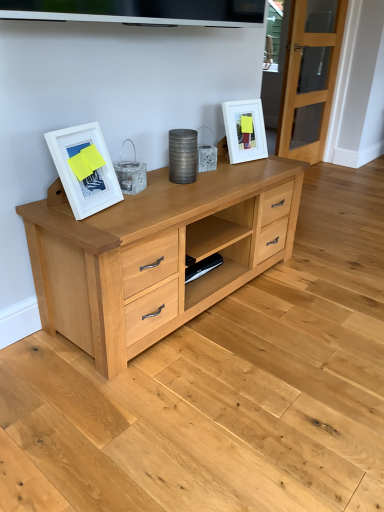
Locate an element on the screen. white matte picture frame at left, the first picture frame positioned from the left is located at coordinates (87, 167).

Measure the distance between white matte picture frame at upper right, which is the 2th picture frame in bottom-to-top order, and camera.

The depth of white matte picture frame at upper right, which is the 2th picture frame in bottom-to-top order, is 6.54 feet.

Identify the location of clear glass door at right. The image size is (384, 512). (309, 80).

The width and height of the screenshot is (384, 512). I want to click on white matte picture frame at left, arranged as the 2th picture frame when viewed from the back, so click(x=87, y=167).

Can you confirm if white matte picture frame at left, which appears as the 2th picture frame when viewed from the top, is smaller than clear glass door at right?

Yes, white matte picture frame at left, which appears as the 2th picture frame when viewed from the top, is smaller than clear glass door at right.

Would you say white matte picture frame at left, the 1th picture frame positioned from the bottom, is inside or outside clear glass door at right?

white matte picture frame at left, the 1th picture frame positioned from the bottom, cannot be found inside clear glass door at right.

Which object is more forward, white matte picture frame at left, the 1th picture frame positioned from the bottom, or clear glass door at right?

white matte picture frame at left, the 1th picture frame positioned from the bottom, is more forward.

Based on the photo, measure the distance from white matte picture frame at left, the 1th picture frame positioned from the bottom, to clear glass door at right.

white matte picture frame at left, the 1th picture frame positioned from the bottom, and clear glass door at right are 7.55 feet apart.

Can you confirm if clear glass door at right is smaller than white matte picture frame at left, arranged as the 2th picture frame when viewed from the back?

No.

From a real-world perspective, which object rests below the other?

white matte picture frame at left, the 1th picture frame positioned from the bottom.

Considering the sizes of clear glass door at right and white matte picture frame at left, placed as the 1th picture frame when sorted from front to back, in the image, is clear glass door at right wider or thinner than white matte picture frame at left, placed as the 1th picture frame when sorted from front to back,?

Considering their sizes, clear glass door at right looks broader than white matte picture frame at left, placed as the 1th picture frame when sorted from front to back.

Looking at this image, from a real-world perspective, which is physically below, white matte picture frame at upper right, acting as the 2th picture frame starting from the left, or white matte picture frame at left, the 1th picture frame positioned from the bottom?

white matte picture frame at upper right, acting as the 2th picture frame starting from the left, from a real-world perspective.

Can white matte picture frame at left, the first picture frame positioned from the left, be found inside white matte picture frame at upper right, which appears as the 1th picture frame when viewed from the top?

No.

From the image's perspective, is white matte picture frame at upper right, which appears as the first picture frame when viewed from the right, beneath white matte picture frame at left, arranged as the 2th picture frame when viewed from the back?

No, from the image's perspective, white matte picture frame at upper right, which appears as the first picture frame when viewed from the right, is not beneath white matte picture frame at left, arranged as the 2th picture frame when viewed from the back.

Considering the sizes of objects white matte picture frame at upper right, acting as the 2th picture frame starting from the left, and white matte picture frame at left, the 1th picture frame positioned from the bottom, in the image provided, who is wider, white matte picture frame at upper right, acting as the 2th picture frame starting from the left, or white matte picture frame at left, the 1th picture frame positioned from the bottom,?

With larger width is white matte picture frame at upper right, acting as the 2th picture frame starting from the left.

Is clear glass door at right in front of white matte picture frame at upper right, which appears as the 1th picture frame when viewed from the top?

No, clear glass door at right is further to the viewer.

Is clear glass door at right not near white matte picture frame at upper right, the 2th picture frame when ordered from front to back?

Indeed, clear glass door at right is not near white matte picture frame at upper right, the 2th picture frame when ordered from front to back.

Is point (297, 138) closer to camera compared to point (263, 130)?

That is False.

How far apart are clear glass door at right and white matte picture frame at upper right, the 2th picture frame when ordered from front to back?

clear glass door at right and white matte picture frame at upper right, the 2th picture frame when ordered from front to back, are 1.38 meters apart.

Based on the photo, from the image's perspective, which is below, white matte picture frame at left, arranged as the 2th picture frame when viewed from the back, or white matte picture frame at upper right, acting as the 2th picture frame starting from the left?

white matte picture frame at left, arranged as the 2th picture frame when viewed from the back, is shown below in the image.

Find the location of `picture frame on the right of the white matte picture frame at left, the first picture frame positioned from the left`. picture frame on the right of the white matte picture frame at left, the first picture frame positioned from the left is located at coordinates (245, 130).

Does white matte picture frame at left, placed as the 1th picture frame when sorted from front to back, have a lesser height compared to white matte picture frame at upper right, which appears as the first picture frame when viewed from the right?

Yes.

Is white matte picture frame at left, which is counted as the second picture frame, starting from the right, placed right next to white matte picture frame at upper right, the 2th picture frame when ordered from front to back?

white matte picture frame at left, which is counted as the second picture frame, starting from the right, and white matte picture frame at upper right, the 2th picture frame when ordered from front to back, are clearly separated.

Considering the sizes of white matte picture frame at upper right, the 2th picture frame when ordered from front to back, and clear glass door at right in the image, is white matte picture frame at upper right, the 2th picture frame when ordered from front to back, bigger or smaller than clear glass door at right?

Clearly, white matte picture frame at upper right, the 2th picture frame when ordered from front to back, is smaller in size than clear glass door at right.

Is clear glass door at right completely or partially inside white matte picture frame at upper right, acting as the 2th picture frame starting from the left?

That's incorrect, clear glass door at right is not inside white matte picture frame at upper right, acting as the 2th picture frame starting from the left.

Between white matte picture frame at upper right, which appears as the first picture frame when viewed from the right, and clear glass door at right, which one has less height?

white matte picture frame at upper right, which appears as the first picture frame when viewed from the right.

Looking at this image, is white matte picture frame at upper right, the 2th picture frame when ordered from front to back, to the left of clear glass door at right from the viewer's perspective?

Correct, you'll find white matte picture frame at upper right, the 2th picture frame when ordered from front to back, to the left of clear glass door at right.

Where is `glass door behind the white matte picture frame at left, which appears as the 2th picture frame when viewed from the top`? The image size is (384, 512). glass door behind the white matte picture frame at left, which appears as the 2th picture frame when viewed from the top is located at coordinates (309, 80).

This screenshot has height=512, width=384. In order to click on picture frame that is the 2nd object located in front of the clear glass door at right in this screenshot , I will do `click(87, 167)`.

Looking at the image, which one is located closer to clear glass door at right, white matte picture frame at left, arranged as the 2th picture frame when viewed from the back, or white matte picture frame at upper right, which appears as the first picture frame when viewed from the right?

white matte picture frame at upper right, which appears as the first picture frame when viewed from the right, is closer to clear glass door at right.

Based on the photo, when comparing their distances from white matte picture frame at left, arranged as the 2th picture frame when viewed from the back, does clear glass door at right or white matte picture frame at upper right, acting as the 2th picture frame starting from the left, seem further?

clear glass door at right is positioned further to the anchor white matte picture frame at left, arranged as the 2th picture frame when viewed from the back.

Considering their positions, is white matte picture frame at upper right, which appears as the 1th picture frame when viewed from the top, positioned closer to white matte picture frame at left, the 1th picture frame positioned from the bottom, than clear glass door at right?

Based on the image, white matte picture frame at upper right, which appears as the 1th picture frame when viewed from the top, appears to be nearer to white matte picture frame at left, the 1th picture frame positioned from the bottom.

Considering their positions, is white matte picture frame at left, the first picture frame positioned from the left, positioned further to white matte picture frame at upper right, which is counted as the 1th picture frame, starting from the back, than clear glass door at right?

clear glass door at right is positioned further to the anchor white matte picture frame at upper right, which is counted as the 1th picture frame, starting from the back.

When comparing their distances from white matte picture frame at upper right, the 2th picture frame when ordered from front to back, does clear glass door at right or white matte picture frame at left, the 1th picture frame positioned from the bottom, seem closer?

The object closer to white matte picture frame at upper right, the 2th picture frame when ordered from front to back, is white matte picture frame at left, the 1th picture frame positioned from the bottom.

From the image, which object appears to be farther from clear glass door at right, white matte picture frame at upper right, which is the 2th picture frame in bottom-to-top order, or white matte picture frame at left, placed as the 1th picture frame when sorted from front to back?

white matte picture frame at left, placed as the 1th picture frame when sorted from front to back, is positioned further to the anchor clear glass door at right.

What are the coordinates of `picture frame between white matte picture frame at left, which appears as the 2th picture frame when viewed from the top, and clear glass door at right, along the z-axis` in the screenshot? It's located at (245, 130).